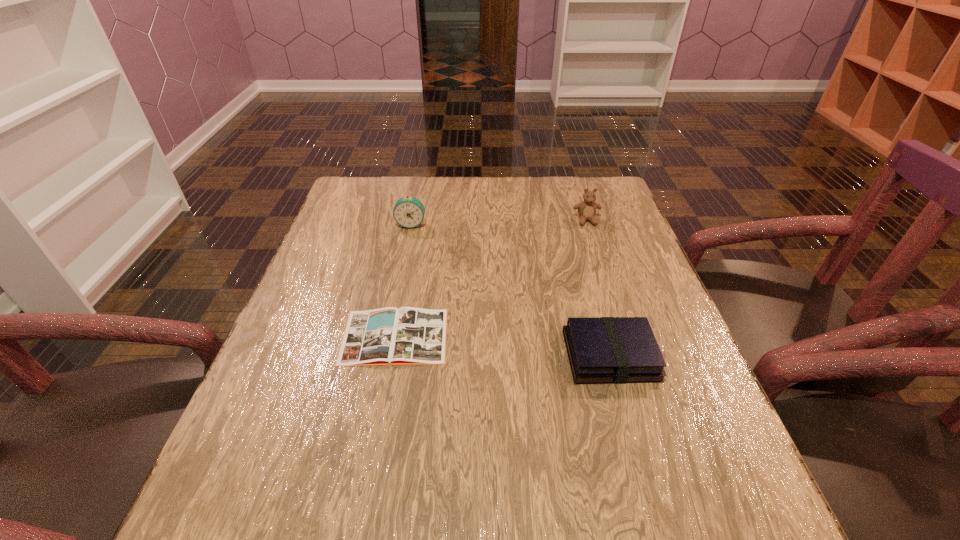
In the image, there is a desktop. Identify the location of free space at the far left corner. This screenshot has height=540, width=960. (389, 184).

At what (x,y) coordinates should I click in order to perform the action: click on blank area at the near left corner. Please return your answer as a coordinate pair (x, y). The image size is (960, 540). Looking at the image, I should click on (279, 537).

Image resolution: width=960 pixels, height=540 pixels. In the image, there is a desktop. Find the location of `free region at the far right corner`. free region at the far right corner is located at coordinates click(x=570, y=179).

In the image, there is a desktop. Where is `vacant space at the near right corner`? vacant space at the near right corner is located at coordinates (747, 494).

Where is `free space between the alarm clock and the shortest object`? free space between the alarm clock and the shortest object is located at coordinates (403, 280).

What are the coordinates of `free spot between the alarm clock and the right book` in the screenshot? It's located at (511, 290).

Locate an element on the screen. Image resolution: width=960 pixels, height=540 pixels. empty space that is in between the alarm clock and the second shortest object is located at coordinates (511, 290).

Find the location of `free space between the shorter book and the third tallest object`. free space between the shorter book and the third tallest object is located at coordinates (502, 346).

At what (x,y) coordinates should I click in order to perform the action: click on free area in between the alarm clock and the teddy bear. Please return your answer as a coordinate pair (x, y). The image size is (960, 540). Looking at the image, I should click on (499, 222).

The width and height of the screenshot is (960, 540). Find the location of `free area in between the alarm clock and the second shortest object`. free area in between the alarm clock and the second shortest object is located at coordinates (511, 290).